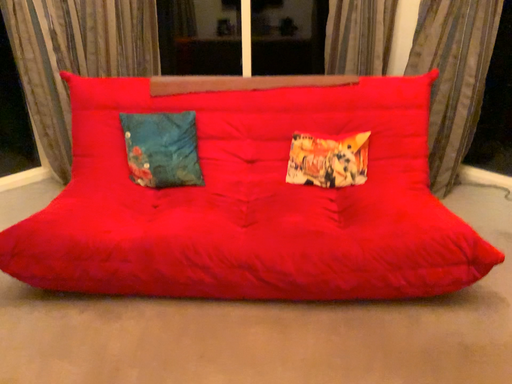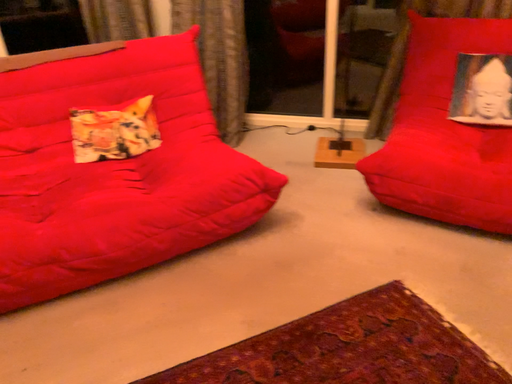
Question: Which way did the camera rotate in the video?

Choices:
 (A) rotated left
 (B) rotated right

Answer: (B)